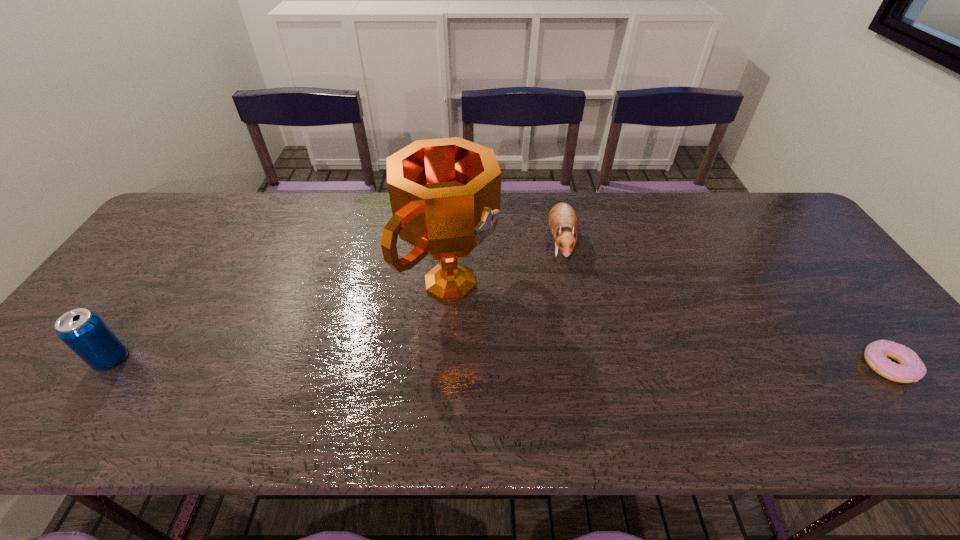
Find the location of a particular element. pop soda is located at coordinates (84, 332).

At what (x,y) coordinates should I click in order to perform the action: click on the leftmost object. Please return your answer as a coordinate pair (x, y). The width and height of the screenshot is (960, 540). Looking at the image, I should click on (84, 332).

Identify the location of the shortest object. The width and height of the screenshot is (960, 540). (910, 369).

Where is `doughnut`? The height and width of the screenshot is (540, 960). doughnut is located at coordinates (910, 369).

You are a GUI agent. You are given a task and a screenshot of the screen. Output one action in this format:
    pyautogui.click(x=<x>, y=<y>)
    Task: Click on the third object from right to left
    
    Given the screenshot: What is the action you would take?
    pyautogui.click(x=445, y=194)

Locate an element on the screen. the tallest object is located at coordinates (445, 194).

Identify the location of hamster. This screenshot has width=960, height=540. (563, 222).

Locate an element on the screen. The image size is (960, 540). the third tallest object is located at coordinates (563, 222).

At what (x,y) coordinates should I click in order to perform the action: click on free space located on the right of the leftmost object. Please return your answer as a coordinate pair (x, y). Looking at the image, I should click on [239, 359].

Locate an element on the screen. This screenshot has width=960, height=540. vacant point located on the back of the rightmost object is located at coordinates (829, 289).